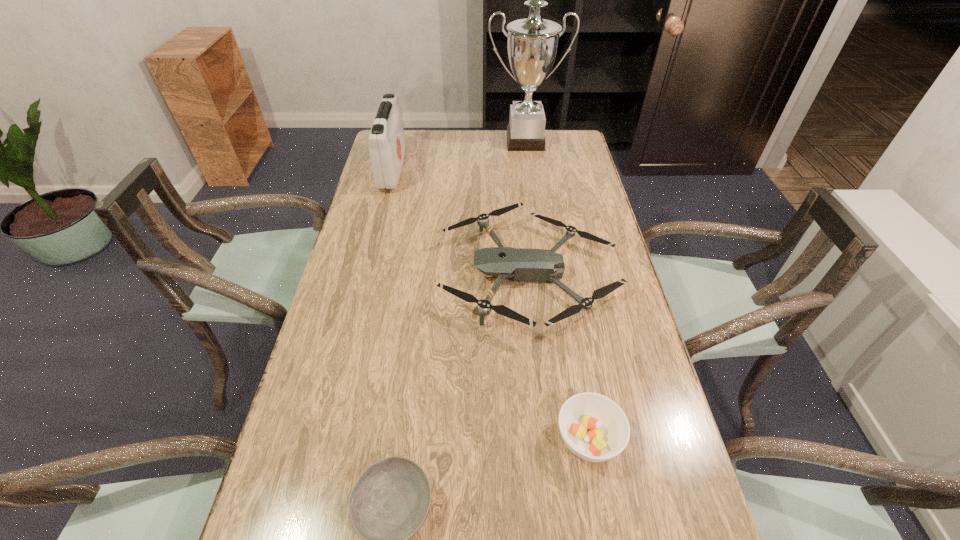
The width and height of the screenshot is (960, 540). Identify the location of the tallest object. (532, 45).

At what (x,y) coordinates should I click in order to perform the action: click on the fourth shortest object. Please return your answer as a coordinate pair (x, y). Looking at the image, I should click on (387, 147).

At what (x,y) coordinates should I click in order to perform the action: click on the first-aid kit. Please return your answer as a coordinate pair (x, y). Image resolution: width=960 pixels, height=540 pixels. Looking at the image, I should click on (387, 147).

What are the coordinates of `the third nearest object` in the screenshot? It's located at (518, 264).

Locate an element on the screen. This screenshot has height=540, width=960. soup bowl is located at coordinates (594, 428).

You are a GUI agent. You are given a task and a screenshot of the screen. Output one action in this format:
    pyautogui.click(x=<x>, y=<y>)
    Task: Click on the vacant position located 0.080m at the front view of the trophy cup
    Image resolution: width=960 pixels, height=540 pixels.
    Given the screenshot: What is the action you would take?
    pyautogui.click(x=528, y=165)

This screenshot has width=960, height=540. In order to click on free space located on the front side of the second tallest object in this screenshot , I will do `click(502, 170)`.

Image resolution: width=960 pixels, height=540 pixels. Find the location of `blank area located 0.100m with a camera mounted on the front of the third nearest object`. blank area located 0.100m with a camera mounted on the front of the third nearest object is located at coordinates (406, 274).

Locate an element on the screen. Image resolution: width=960 pixels, height=540 pixels. free point located 0.050m with a camera mounted on the front of the third nearest object is located at coordinates (423, 274).

Find the location of a particular element. The height and width of the screenshot is (540, 960). vacant space located 0.240m with a camera mounted on the front of the third nearest object is located at coordinates point(358,274).